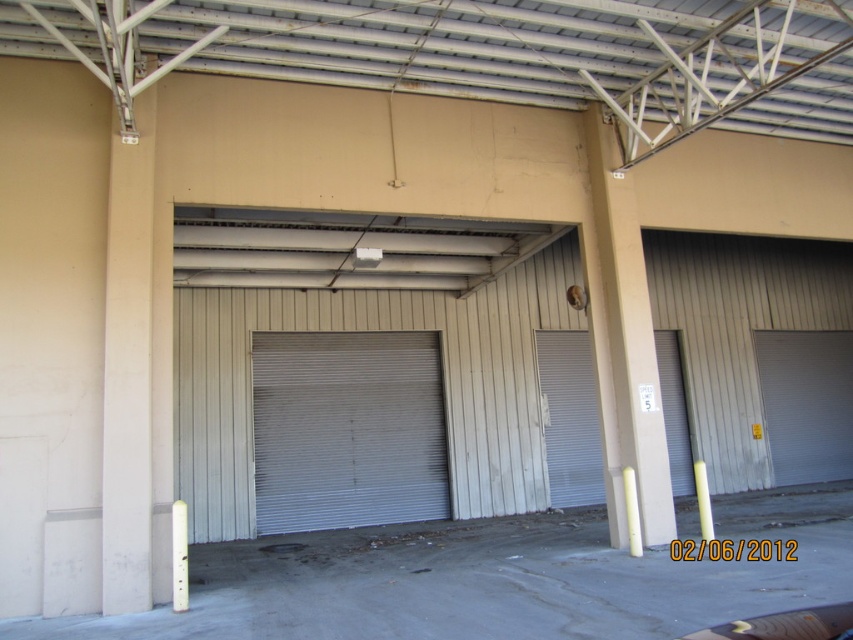
Does white corrugated metal garage door at center have a larger size compared to gray metallic door at center?

Yes.

Which is more to the right, white corrugated metal garage door at center or gray metallic door at center?

Positioned to the right is gray metallic door at center.

I want to click on white corrugated metal garage door at center, so click(347, 429).

Between point (437, 492) and point (842, 337), which one is positioned behind?

Point (842, 337)

Between white corrugated metal garage door at center and white metallic door at right, which one appears on the left side from the viewer's perspective?

white corrugated metal garage door at center

At what (x,y) coordinates should I click in order to perform the action: click on white corrugated metal garage door at center. Please return your answer as a coordinate pair (x, y). The width and height of the screenshot is (853, 640). Looking at the image, I should click on (347, 429).

Between gray metallic door at center and white metallic door at right, which one has less height?

white metallic door at right is shorter.

Does point (672, 385) come closer to viewer compared to point (799, 465)?

Yes, it is.

Find the location of `gray metallic door at center`. gray metallic door at center is located at coordinates pos(569,419).